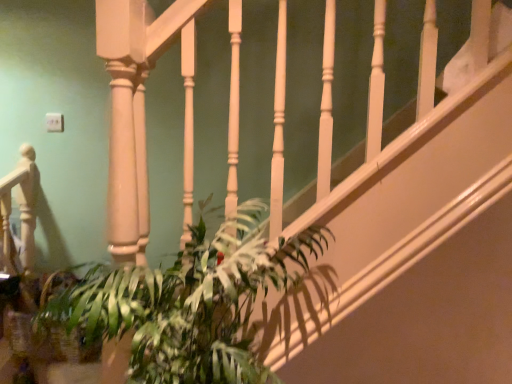
From the picture: What is the approximate height of green glossy plant at center?

21.16 inches.

Describe the element at coordinates (190, 303) in the screenshot. I see `green glossy plant at center` at that location.

I want to click on green glossy plant at center, so click(190, 303).

Where is `green glossy plant at center`? green glossy plant at center is located at coordinates (190, 303).